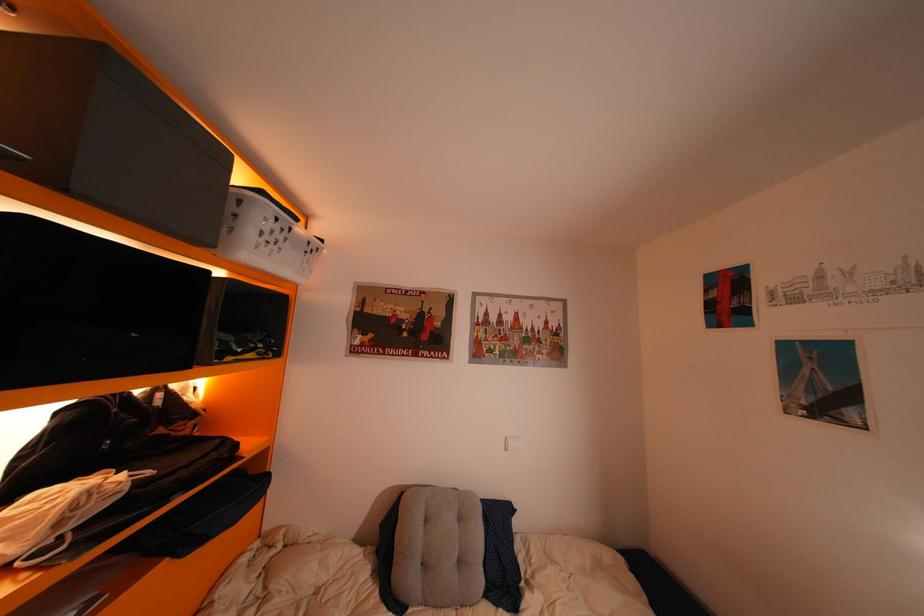
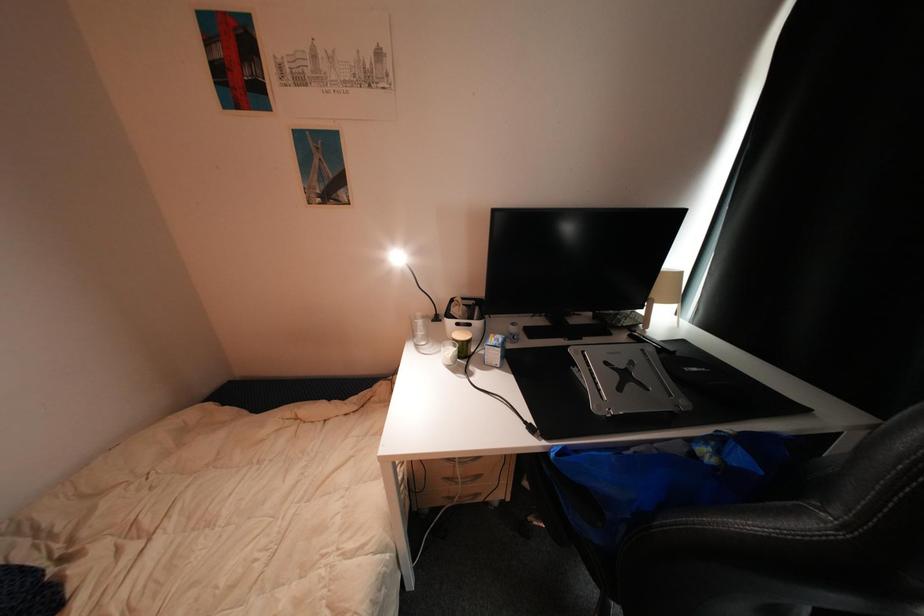
The first image is from the beginning of the video and the second image is from the end. How did the camera likely rotate when shooting the video?

The camera rotated toward right-down.